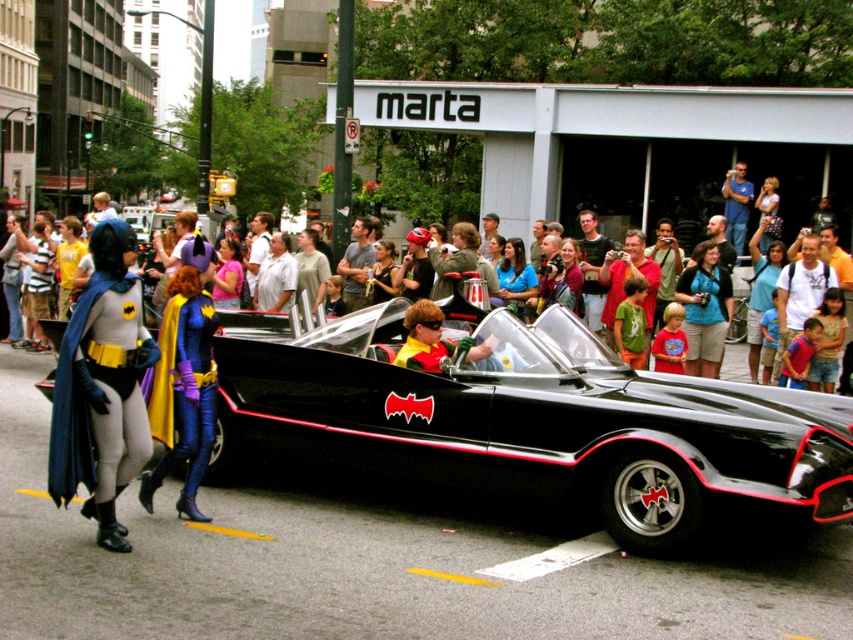
Question: Which object is farther from the camera taking this photo?

Choices:
 (A) shiny red and yellow costume at center
 (B) shiny purple fabric cape at center
 (C) light brown shirt at center
 (D) matte black shirt at center

Answer: (C)

Question: Does shiny purple fabric cape at center lie behind matte black shirt at center?

Choices:
 (A) yes
 (B) no

Answer: (B)

Question: Considering the real-world distances, which object is farthest from the matte black shirt at center?

Choices:
 (A) blue denim jeans at center
 (B) black glossy batmobile at center

Answer: (A)

Question: Can you confirm if shiny red and yellow costume at center is bigger than matte black shirt at center?

Choices:
 (A) no
 (B) yes

Answer: (A)

Question: Which point is closer to the camera?

Choices:
 (A) smooth gray bodysuit at left
 (B) light brown shirt at center
 (C) shiny red and yellow costume at center

Answer: (A)

Question: Is black glossy batmobile at center in front of matte black car at center?

Choices:
 (A) yes
 (B) no

Answer: (A)